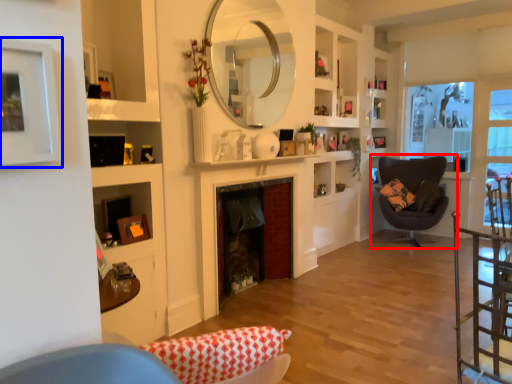
Question: Among these objects, which one is farthest to the camera, chair (highlighted by a red box) or picture frame (highlighted by a blue box)?

Choices:
 (A) chair
 (B) picture frame

Answer: (A)